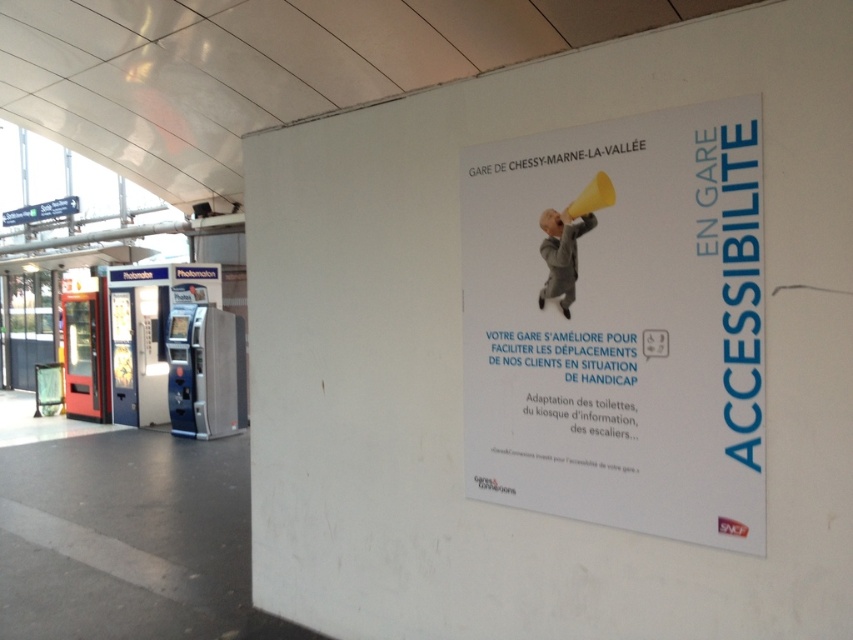
Between white paper poster at center and light gray fabric at center, which one appears on the right side from the viewer's perspective?

Positioned to the right is white paper poster at center.

Is white paper poster at center above light gray fabric at center?

No.

You are a GUI agent. You are given a task and a screenshot of the screen. Output one action in this format:
    pyautogui.click(x=<x>, y=<y>)
    Task: Click on the white paper poster at center
    
    Given the screenshot: What is the action you would take?
    619,324

The width and height of the screenshot is (853, 640). Identify the location of white paper poster at center. (619, 324).